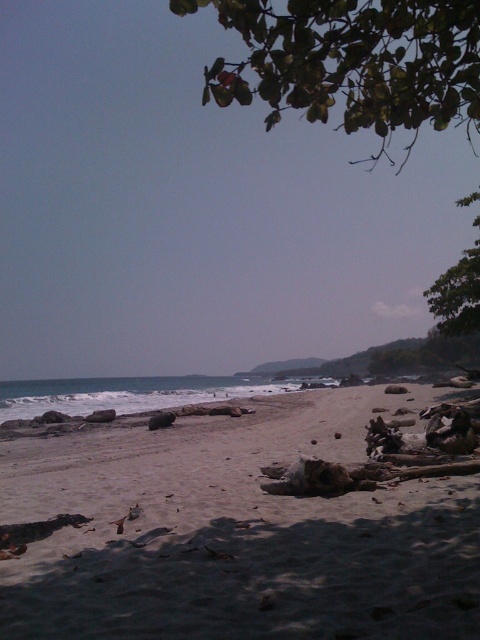
Question: Observing the image, what is the correct spatial positioning of white sandy beach at center in reference to green leafy branch at upper center?

Choices:
 (A) left
 (B) right

Answer: (A)

Question: Which object is farther from the camera taking this photo?

Choices:
 (A) green leafy tree at upper right
 (B) white sandy beach at center
 (C) blue water at lower left
 (D) green leafy branch at upper center

Answer: (C)

Question: Is green leafy branch at upper center to the right of blue water at lower left from the viewer's perspective?

Choices:
 (A) yes
 (B) no

Answer: (A)

Question: Among these objects, which one is nearest to the camera?

Choices:
 (A) blue water at lower left
 (B) green leafy branch at upper center
 (C) green leafy tree at upper right

Answer: (B)

Question: Which point is closer to the camera taking this photo?

Choices:
 (A) (97, 400)
 (B) (420, 76)
 (C) (364, 516)

Answer: (C)

Question: Is white sandy beach at center above green leafy tree at upper right?

Choices:
 (A) no
 (B) yes

Answer: (A)